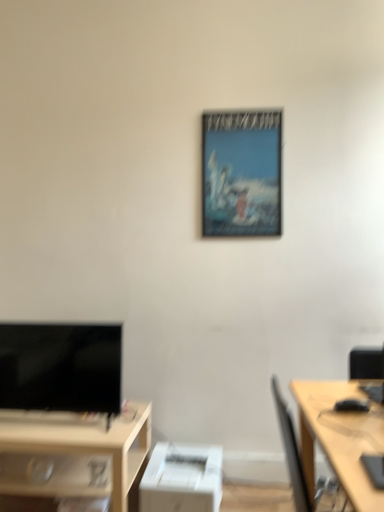
Question: Can you see white matte printer at lower center touching black glossy tv at lower left?

Choices:
 (A) yes
 (B) no

Answer: (B)

Question: Is white matte printer at lower center far away from black glossy tv at lower left?

Choices:
 (A) yes
 (B) no

Answer: (B)

Question: Is white matte printer at lower center facing towards black glossy tv at lower left?

Choices:
 (A) yes
 (B) no

Answer: (B)

Question: Does white matte printer at lower center have a greater width compared to black glossy tv at lower left?

Choices:
 (A) no
 (B) yes

Answer: (B)

Question: Is black glossy tv at lower left a part of white matte printer at lower center?

Choices:
 (A) no
 (B) yes

Answer: (A)

Question: Based on their positions, is light wood desk at right, which is counted as the second desk, starting from the bottom, located to the left or right of white matte printer at lower center?

Choices:
 (A) left
 (B) right

Answer: (B)

Question: Choose the correct answer: Is light wood desk at right, positioned as the 2th desk in back-to-front order, inside white matte printer at lower center or outside it?

Choices:
 (A) inside
 (B) outside

Answer: (B)

Question: Is light wood desk at right, placed as the 1th desk when sorted from top to bottom, in front of or behind white matte printer at lower center in the image?

Choices:
 (A) behind
 (B) front

Answer: (B)

Question: Considering the positions of light wood desk at right, which is counted as the second desk, starting from the bottom, and white matte printer at lower center in the image, is light wood desk at right, which is counted as the second desk, starting from the bottom, taller or shorter than white matte printer at lower center?

Choices:
 (A) tall
 (B) short

Answer: (A)

Question: Choose the correct answer: Is matte white desk at lower left, which ranks as the first desk in left-to-right order, inside metallic poster at center or outside it?

Choices:
 (A) outside
 (B) inside

Answer: (A)

Question: In the image, is matte white desk at lower left, placed as the second desk when sorted from front to back, positioned in front of or behind metallic poster at center?

Choices:
 (A) front
 (B) behind

Answer: (A)

Question: In terms of width, does matte white desk at lower left, marked as the second desk in a right-to-left arrangement, look wider or thinner when compared to metallic poster at center?

Choices:
 (A) wide
 (B) thin

Answer: (A)

Question: From the image's perspective, relative to metallic poster at center, is matte white desk at lower left, the 2th desk when ordered from top to bottom, above or below?

Choices:
 (A) below
 (B) above

Answer: (A)

Question: Considering their positions, is black glossy tv at lower left located in front of or behind matte white desk at lower left, the 2th desk when ordered from top to bottom?

Choices:
 (A) behind
 (B) front

Answer: (A)

Question: Would you say black glossy tv at lower left is to the left or to the right of matte white desk at lower left, marked as the second desk in a right-to-left arrangement, in the picture?

Choices:
 (A) right
 (B) left

Answer: (A)